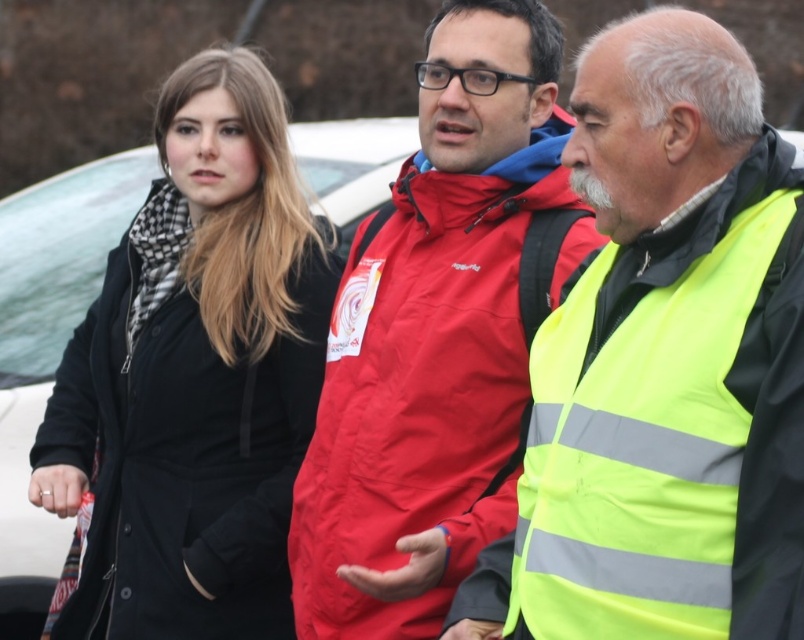
You are a photographer trying to capture a group photo of the black matte coat at left and the red matte jacket at center. The camera you are using has a minimum focusing distance of 5 feet. Will you be able to take a clear photo of both subjects without moving them?

The distance between the black matte coat at left and the red matte jacket at center is 4.91 feet, which is less than the camera minimum focusing distance of 5 feet. Therefore, you will not be able to take a clear photo of both subjects without moving them closer together.

Based on the photo, you are standing at the point labeled point (774, 337) in the image. If you want to walk directly towards the viewer, which direction should you face?

Since the point (774, 337) is 29.66 feet away from the viewer, you should face directly towards the viewer to walk towards them.